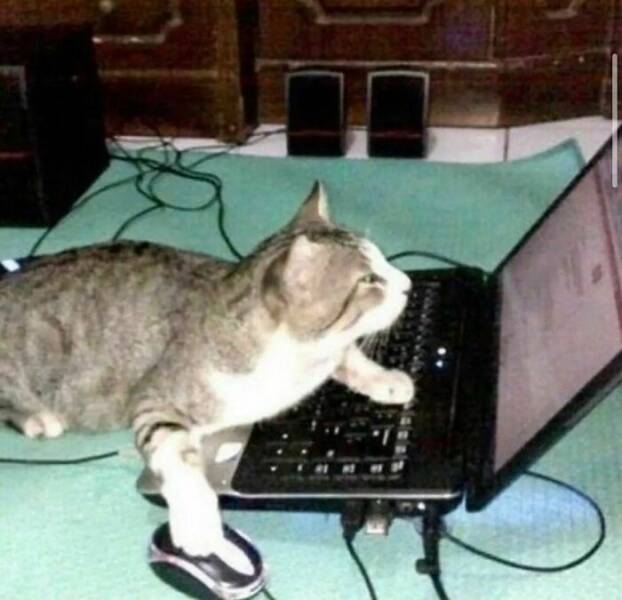
This screenshot has height=600, width=622. What are the coordinates of `laptop screen` in the screenshot? It's located at (565, 313).